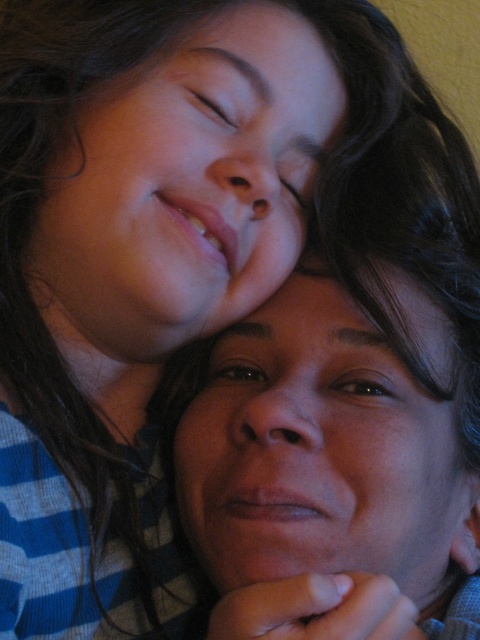
Question: Is smooth skin face at upper center positioned behind smooth skin face at center?

Choices:
 (A) yes
 (B) no

Answer: (A)

Question: Among these points, which one is nearest to the camera?

Choices:
 (A) (325, 317)
 (B) (165, 147)

Answer: (B)

Question: Considering the relative positions of smooth skin face at upper center and smooth skin face at center in the image provided, where is smooth skin face at upper center located with respect to smooth skin face at center?

Choices:
 (A) left
 (B) right

Answer: (A)

Question: Which point is farther to the camera?

Choices:
 (A) (301, 564)
 (B) (226, 76)

Answer: (B)

Question: Is smooth skin face at upper center bigger than smooth skin face at center?

Choices:
 (A) yes
 (B) no

Answer: (B)